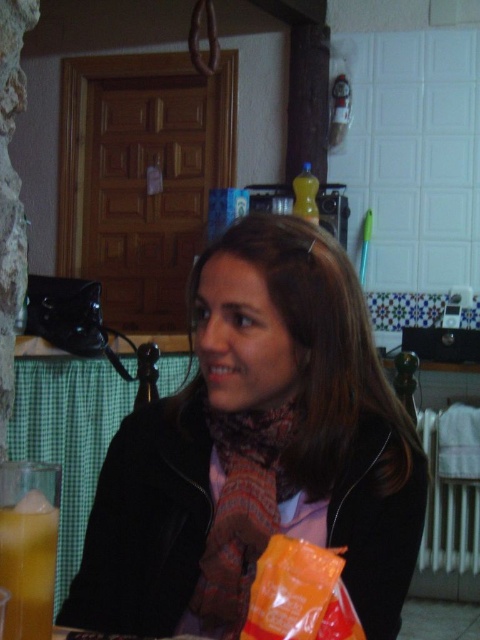
You are a tailor who needs to determine which item requires more fabric for alterations between the matte black jacket at center and the multicolored woven scarf at center. Based on the scene, which item would need more fabric?

Result: The matte black jacket at center requires more fabric than the multicolored woven scarf at center because its width is larger, indicating it might need more material for alterations.

You are a guest in this kitchen and want to place a small plate between the multicolored woven scarf at center and the translucent glass juice at lower left. Based on their positions, which object should the plate be closer to?

The multicolored woven scarf at center is to the right of the translucent glass juice at lower left, so the plate should be placed closer to the translucent glass juice at lower left to be between them.